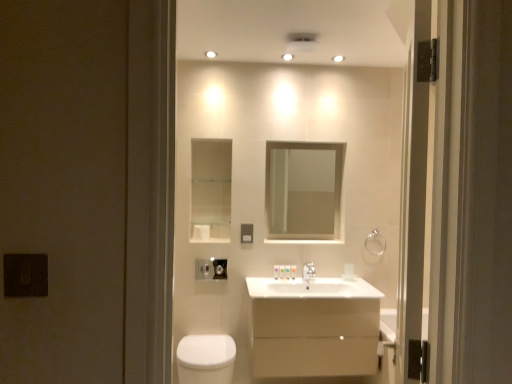
Question: Visually, is white matte toilet paper at center positioned to the left or to the right of clear glass mirror at upper center?

Choices:
 (A) left
 (B) right

Answer: (A)

Question: Looking at their shapes, would you say white matte toilet paper at center is wider or thinner than clear glass mirror at upper center?

Choices:
 (A) thin
 (B) wide

Answer: (B)

Question: Estimate the real-world distances between objects in this image. Which object is closer to the silver metallic towel bar at upper right?

Choices:
 (A) matte silver outlet at center
 (B) satin nickel faucet at center
 (C) black metal screen door at right
 (D) clear glass mirror at upper center
 (E) white glossy toiletries at center, the second toiletry viewed from the left

Answer: (B)

Question: Considering the real-world distances, which object is closest to the translucent plastic tube at center, placed as the 1th toiletry when sorted from left to right?

Choices:
 (A) silver metallic towel bar at upper right
 (B) white glossy toilet at lower left
 (C) satin nickel faucet at center
 (D) white glossy toiletries at center, the second toiletry viewed from the left
 (E) matte silver outlet at center

Answer: (D)